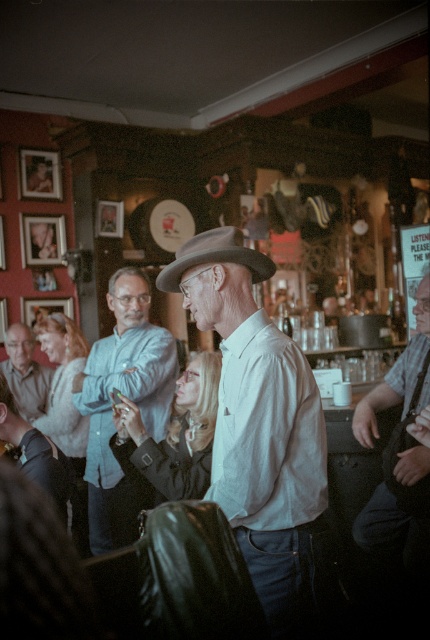
You are a fashion designer observing the scene. You need to determine which item has a more slender shape between the gray felt fedora at center and the matte gray shirt at lower left. Which one is it?

The gray felt fedora at center is thinner than the matte gray shirt at lower left, so the gray felt fedora at center has a more slender shape.

You are a photographer at the event and want to capture both the light blue shirt at center and the gray felt fedora at center in the same frame. Since the camera can only focus on one subject at a time, which one should you focus on to ensure the other remains in the background?

The light blue shirt at center is positioned under the gray felt fedora at center, so focusing on the gray felt fedora at center will keep the light blue shirt at center in the background.

You are a photographer setting up for an event at this bar. You need to position a spotlight so it shines on both the gray felt fedora at center and the matte gray shirt at lower left without overlapping the light beams. Given the spatial arrangement, is this possible?

The gray felt fedora at center is above the matte gray shirt at lower left, so you can position the spotlight to shine downward on the gray felt fedora at center and another spotlight upward toward the matte gray shirt at lower left, ensuring the light beams do not overlap.